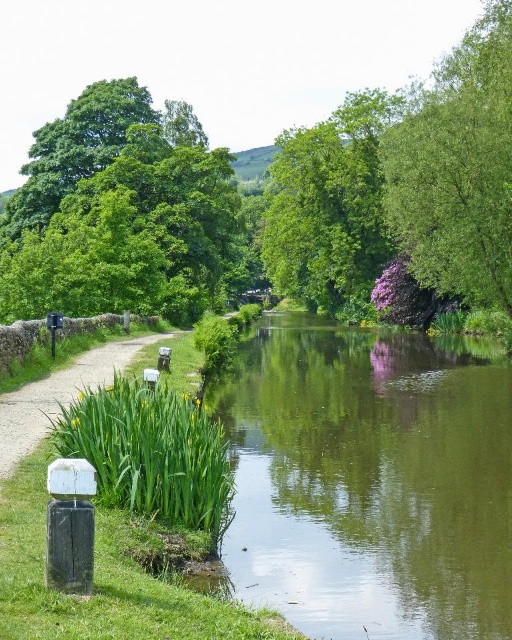
You are a hiker who wants to take a photo of the green leafy tree at upper center while standing on the white concrete path at lower left. Is the tree visible from your position?

The green leafy tree at upper center is located above the white concrete path at lower left, so yes, the tree is visible from the path.

You are standing on the white concrete path at lower left and want to walk towards the green leafy tree at right. Which direction should you head?

The green leafy tree at right is positioned on the right side of the white concrete path at lower left, so you should head to the right to reach it.